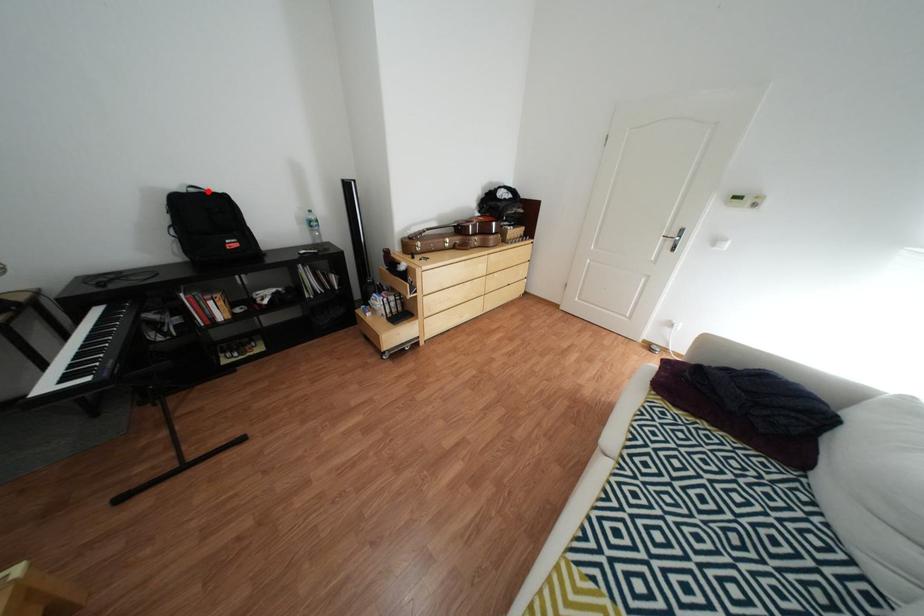
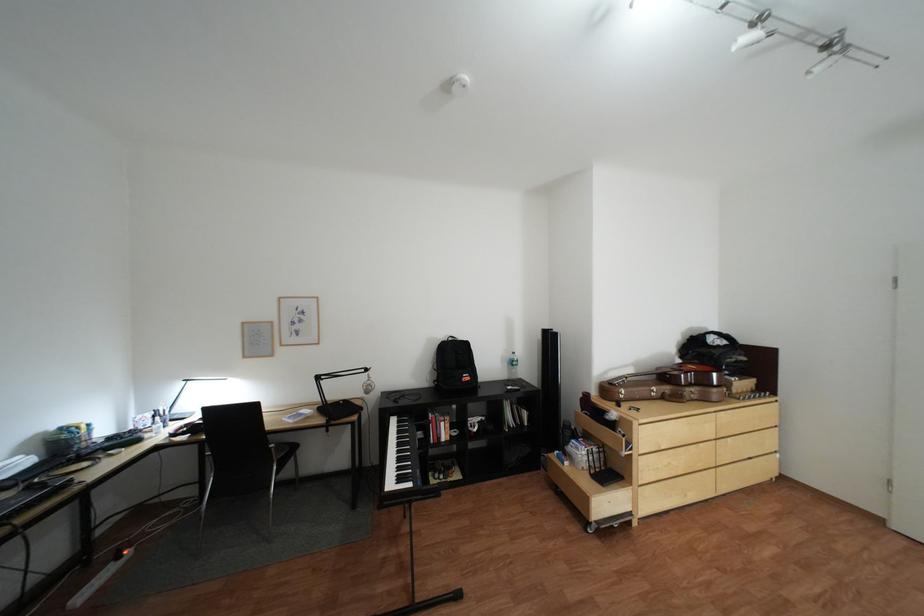
Locate, in the second image, the point that corresponds to the highlighted location in the first image.

(466, 339)